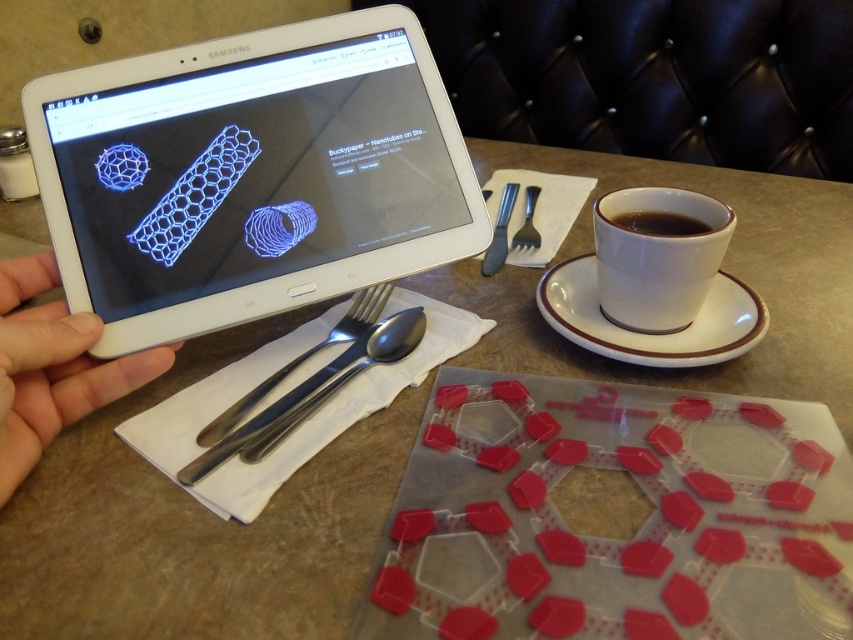
You are a waiter in a restaurant and need to clear the table. You see the silver metallic spoon at center and the black ceramic cup at right. Which item should you pick up first to follow proper table clearing protocol?

You should pick up the silver metallic spoon at center first because it is in front of the black ceramic cup at right, and proper protocol usually involves removing items starting from the frontmost objects.

You are a server at the restaurant and need to place a new menu between the silver metallic spoon at center and the black ceramic cup at right. Since the menu is 10 cm wide, can you fit it between them without moving the spoon or cup?

The silver metallic spoon at center is wider than the black ceramic cup at right. Since the menu is 10 cm wide, you need to check the distance between them. However, the description only states the spoon is wider, not the distance between them. Therefore, it is unclear if the menu will fit without additional information about the spacing between the spoon and cup.